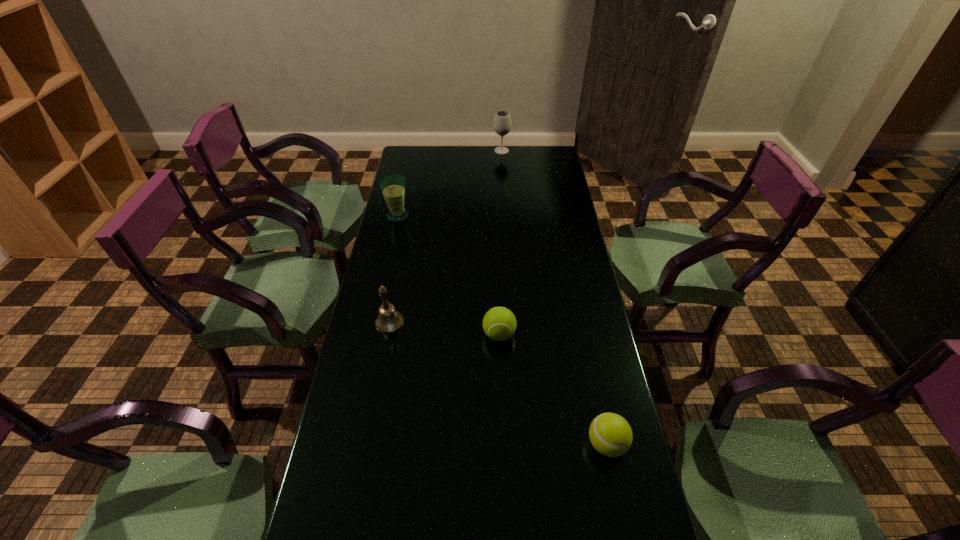
At what (x,y) coordinates should I click in order to perform the action: click on blank area in the image that satisfies the following two spatial constraints: 1. on the front side of the left tennis ball; 2. on the left side of the right tennis ball. Please return your answer as a coordinate pair (x, y). This screenshot has height=540, width=960. Looking at the image, I should click on (503, 444).

Image resolution: width=960 pixels, height=540 pixels. I want to click on vacant position in the image that satisfies the following two spatial constraints: 1. on the front side of the bell; 2. on the left side of the glass, so click(374, 322).

Identify the location of free space in the image that satisfies the following two spatial constraints: 1. on the front side of the farther tennis ball; 2. on the right side of the second farthest object. (372, 334).

I want to click on vacant space that satisfies the following two spatial constraints: 1. on the front side of the farther tennis ball; 2. on the left side of the bell, so click(x=387, y=334).